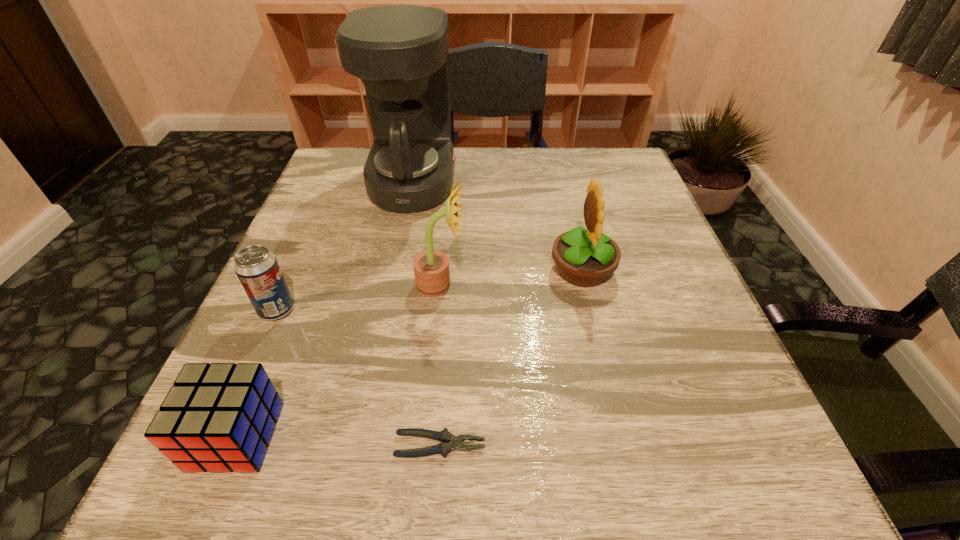
This screenshot has width=960, height=540. Find the location of `vacant space at the near right corner of the desktop`. vacant space at the near right corner of the desktop is located at coordinates (688, 505).

The height and width of the screenshot is (540, 960). Find the location of `free spot between the cube and the rightmost object`. free spot between the cube and the rightmost object is located at coordinates (409, 353).

Where is `free space between the shortest object and the rightmost object`? free space between the shortest object and the rightmost object is located at coordinates (511, 357).

Find the location of a particular element. blank region between the pliers and the beer can is located at coordinates (358, 377).

In order to click on vacant space that is in between the shortest object and the left sunflower in this screenshot , I will do `click(441, 365)`.

In order to click on vacant space in between the rightmost object and the fifth tallest object in this screenshot , I will do `click(409, 353)`.

This screenshot has height=540, width=960. In order to click on free space between the shortest object and the farthest object in this screenshot , I will do `click(426, 314)`.

Image resolution: width=960 pixels, height=540 pixels. Find the location of `free space that is in between the right sunflower and the pliers`. free space that is in between the right sunflower and the pliers is located at coordinates (511, 357).

Find the location of `vacant space that is in between the coffee maker and the cube`. vacant space that is in between the coffee maker and the cube is located at coordinates (324, 309).

Image resolution: width=960 pixels, height=540 pixels. I want to click on empty space that is in between the tallest object and the cube, so click(324, 309).